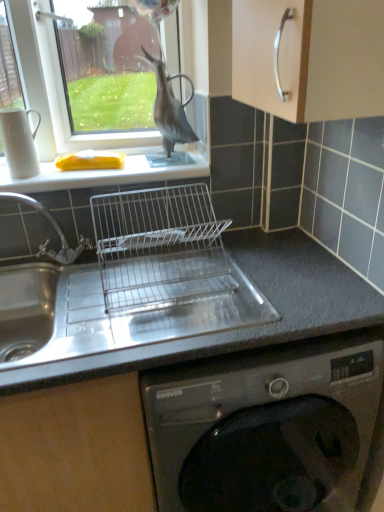
Question: From a real-world perspective, is white matte sponge at upper left physically below smooth gray countertop at center?

Choices:
 (A) yes
 (B) no

Answer: (B)

Question: Considering the relative sizes of white matte sponge at upper left and smooth gray countertop at center in the image provided, is white matte sponge at upper left smaller than smooth gray countertop at center?

Choices:
 (A) yes
 (B) no

Answer: (A)

Question: Is white matte sponge at upper left wider than smooth gray countertop at center?

Choices:
 (A) yes
 (B) no

Answer: (B)

Question: Would you say white matte sponge at upper left is outside smooth gray countertop at center?

Choices:
 (A) no
 (B) yes

Answer: (B)

Question: Does white matte sponge at upper left have a greater height compared to smooth gray countertop at center?

Choices:
 (A) no
 (B) yes

Answer: (A)

Question: Is white matte sponge at upper left closer to camera compared to smooth gray countertop at center?

Choices:
 (A) no
 (B) yes

Answer: (A)

Question: Are white matte sponge at upper left and clear glass window at upper left far apart?

Choices:
 (A) yes
 (B) no

Answer: (B)

Question: Does white matte sponge at upper left appear on the right side of clear glass window at upper left?

Choices:
 (A) yes
 (B) no

Answer: (A)

Question: Is white matte sponge at upper left facing towards clear glass window at upper left?

Choices:
 (A) yes
 (B) no

Answer: (B)

Question: Is white matte sponge at upper left positioned in front of clear glass window at upper left?

Choices:
 (A) yes
 (B) no

Answer: (B)

Question: Is white matte sponge at upper left turned away from clear glass window at upper left?

Choices:
 (A) no
 (B) yes

Answer: (A)

Question: Can you confirm if white matte sponge at upper left is thinner than clear glass window at upper left?

Choices:
 (A) no
 (B) yes

Answer: (A)

Question: Can you confirm if matte black bird at upper center is bigger than smooth gray countertop at center?

Choices:
 (A) yes
 (B) no

Answer: (B)